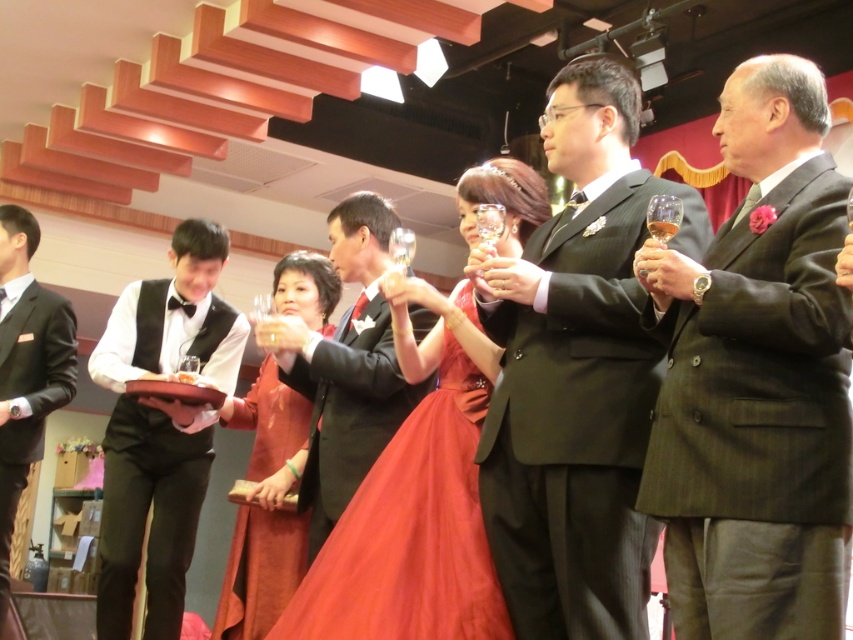
Question: Which point is closer to the camera taking this photo?

Choices:
 (A) (283, 538)
 (B) (247, 413)
 (C) (457, 422)

Answer: (C)

Question: Is dark gray suit at center to the left of dark green pinstripe suit at center from the viewer's perspective?

Choices:
 (A) yes
 (B) no

Answer: (B)

Question: Is shiny red dress at center further to camera compared to matte black suit at left?

Choices:
 (A) no
 (B) yes

Answer: (A)

Question: Does shiny black suit at center have a smaller size compared to matte black suit at left?

Choices:
 (A) yes
 (B) no

Answer: (A)

Question: Estimate the real-world distances between objects in this image. Which object is farther from the shiny red dress at center?

Choices:
 (A) velvet red dress at center
 (B) shiny black suit at center
 (C) black satin vest at center

Answer: (B)

Question: Which of these objects is positioned closest to the shiny satin dress at center?

Choices:
 (A) velvet red dress at center
 (B) shiny black suit at center

Answer: (B)